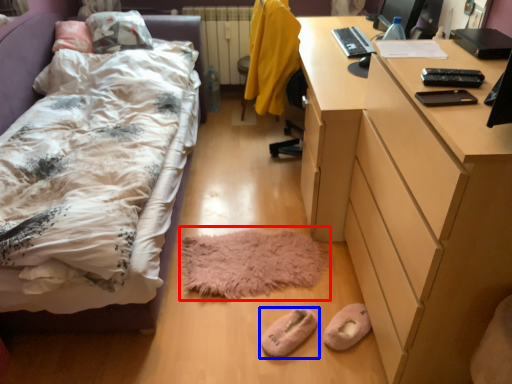
Question: Which point is further to the camera, mat (highlighted by a red box) or footwear (highlighted by a blue box)?

Choices:
 (A) mat
 (B) footwear

Answer: (A)